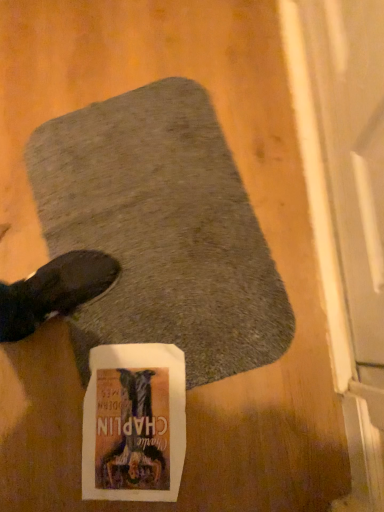
The image size is (384, 512). In order to click on vacant area that is situated to the right of white paper flyer at center in this screenshot , I will do `click(238, 380)`.